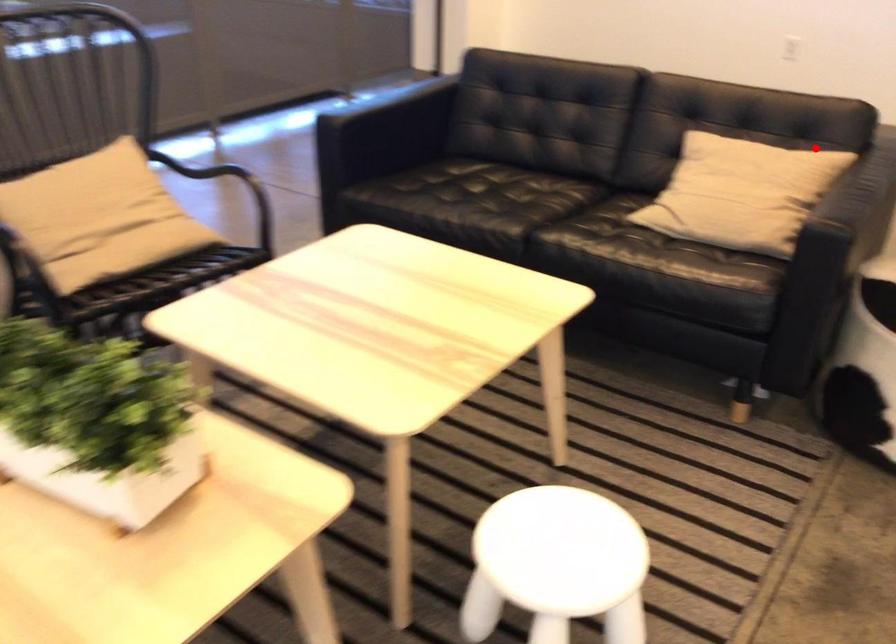
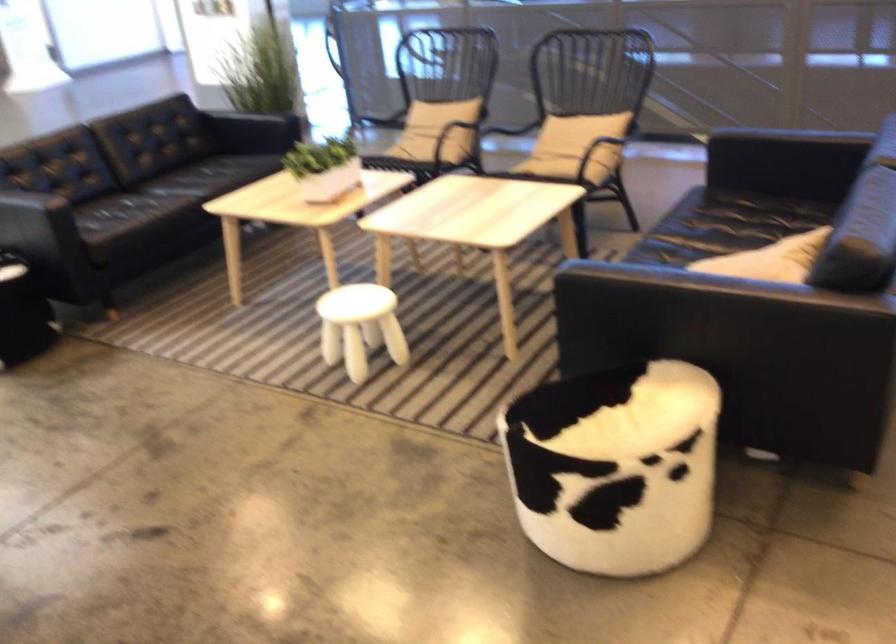
Find the pixel in the second image that matches the highlighted location in the first image.

(770, 259)